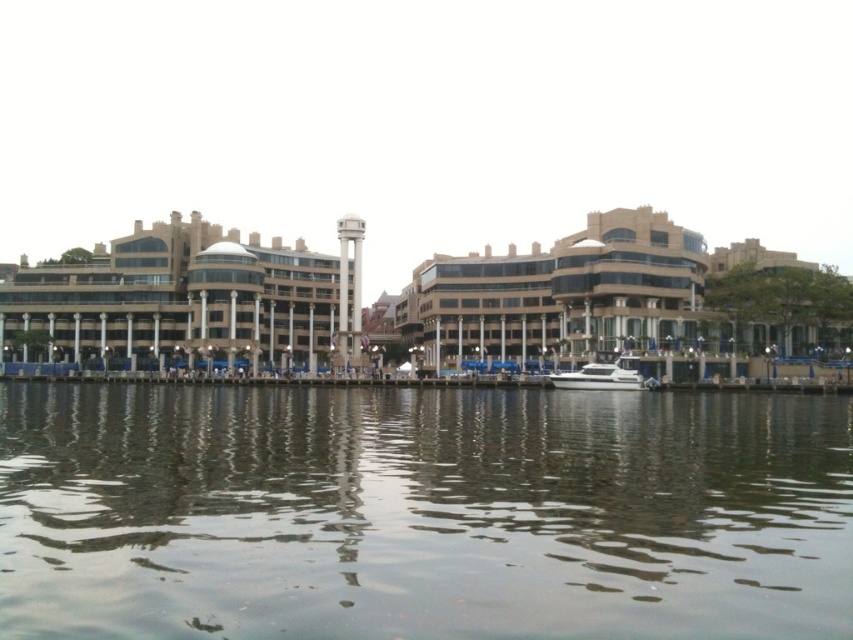
Question: Is greenish reflective water at center to the right of white glossy boat at center from the viewer's perspective?

Choices:
 (A) no
 (B) yes

Answer: (A)

Question: Which of the following is the closest to the observer?

Choices:
 (A) (247, 448)
 (B) (566, 384)

Answer: (A)

Question: Among these points, which one is farthest from the camera?

Choices:
 (A) (578, 387)
 (B) (316, 636)

Answer: (A)

Question: Among these points, which one is farthest from the camera?

Choices:
 (A) (634, 380)
 (B) (851, 445)

Answer: (A)

Question: Is greenish reflective water at center below white glossy boat at center?

Choices:
 (A) yes
 (B) no

Answer: (A)

Question: Does greenish reflective water at center appear on the left side of white glossy boat at center?

Choices:
 (A) yes
 (B) no

Answer: (A)